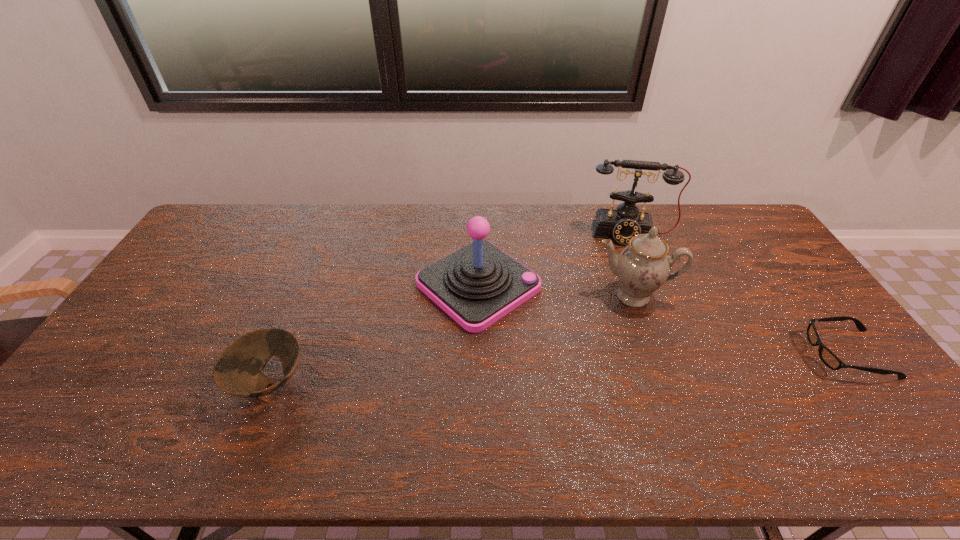
At what (x,y) coordinates should I click in order to perform the action: click on object located in the far edge section of the desktop. Please return your answer as a coordinate pair (x, y). The height and width of the screenshot is (540, 960). Looking at the image, I should click on (625, 222).

This screenshot has height=540, width=960. I want to click on object at the near edge, so click(238, 371).

The width and height of the screenshot is (960, 540). I want to click on object at the right edge, so click(826, 355).

Locate an element on the screen. The width and height of the screenshot is (960, 540). vacant space at the far edge is located at coordinates (316, 216).

Where is `vacant region at the near edge of the desktop`? This screenshot has width=960, height=540. vacant region at the near edge of the desktop is located at coordinates (542, 408).

The height and width of the screenshot is (540, 960). Identify the location of free space at the left edge of the desktop. point(155,370).

Identify the location of blank area at the right edge. The height and width of the screenshot is (540, 960). coord(806,307).

The image size is (960, 540). I want to click on vacant region at the far left corner of the desktop, so click(255, 207).

Identify the location of free spot between the shortest object and the telephone. (738, 294).

This screenshot has height=540, width=960. What are the coordinates of `free space between the leftmost object and the shortest object` in the screenshot? It's located at (559, 368).